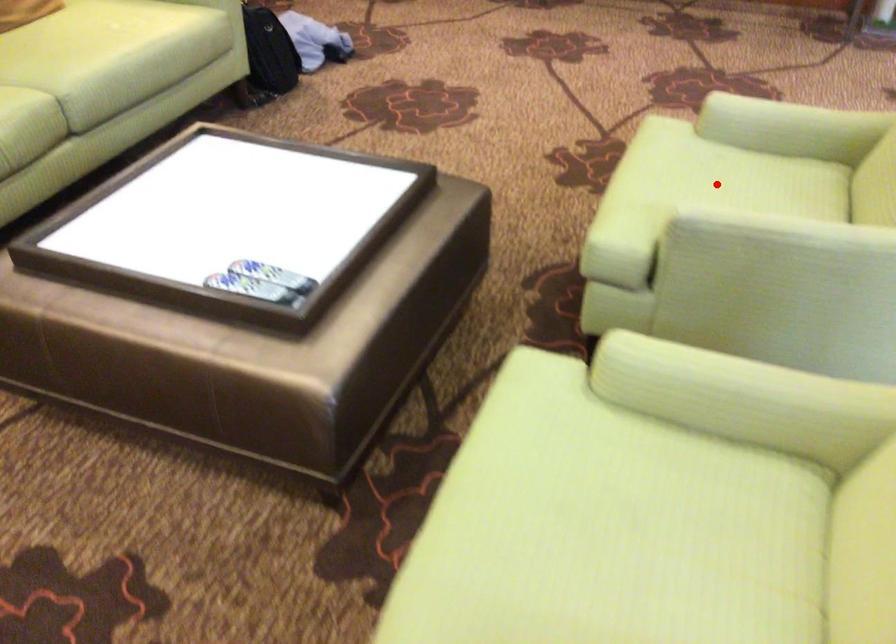
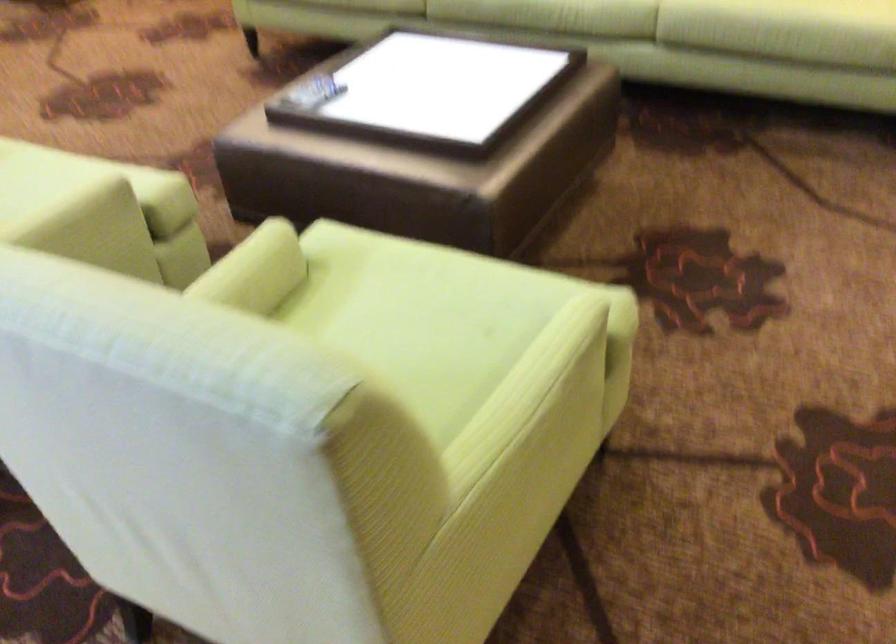
Where in the second image is the point corresponding to the highlighted location from the first image?

(410, 328)